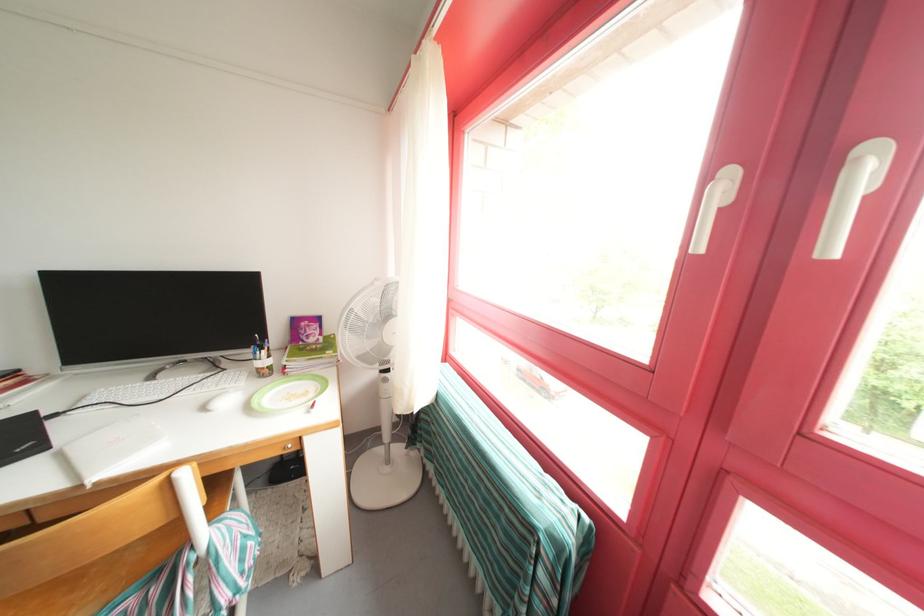
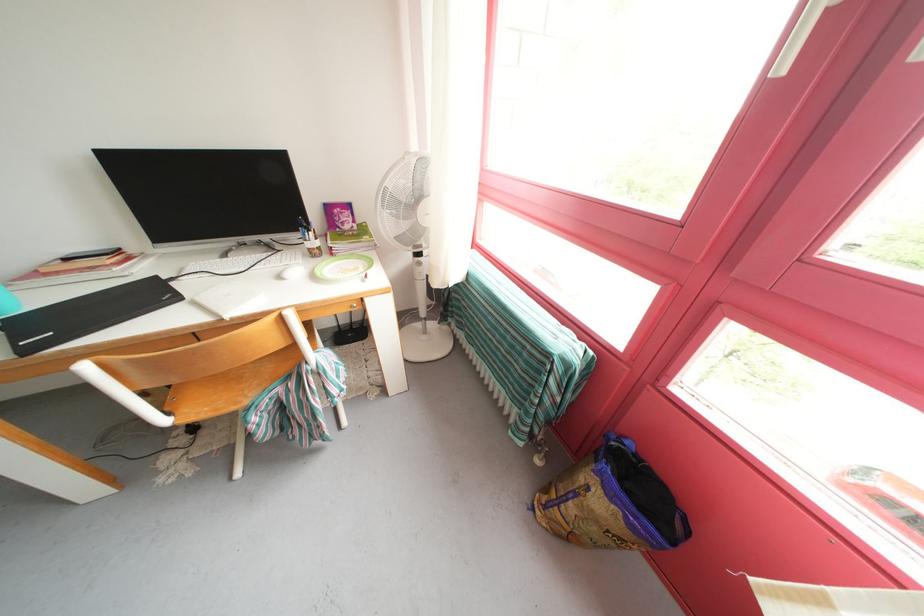
In the second image, find the point that corresponds to (x=323, y=382) in the first image.

(369, 262)